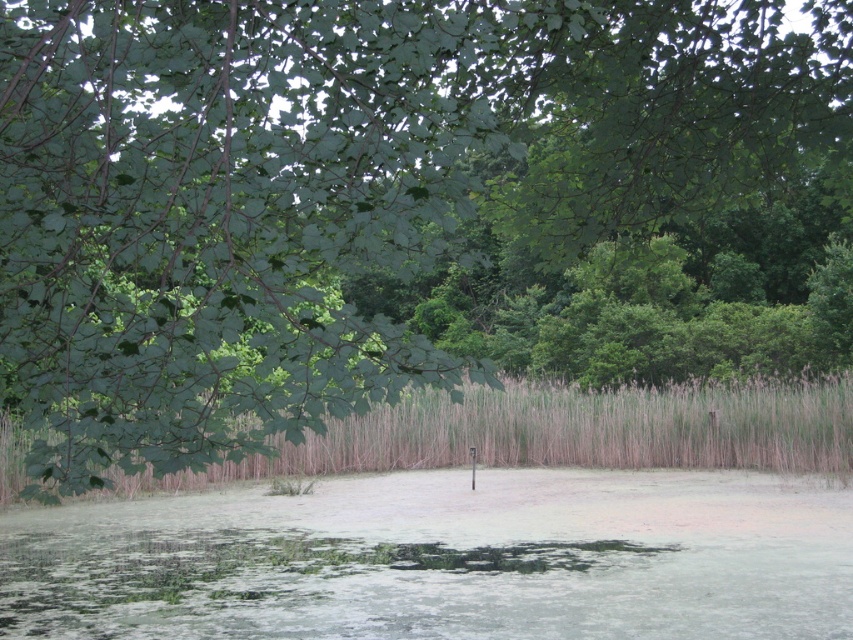
Is green algae water at center taller than brown grass at center?

In fact, green algae water at center may be shorter than brown grass at center.

In order to click on green algae water at center in this screenshot , I will do `click(442, 560)`.